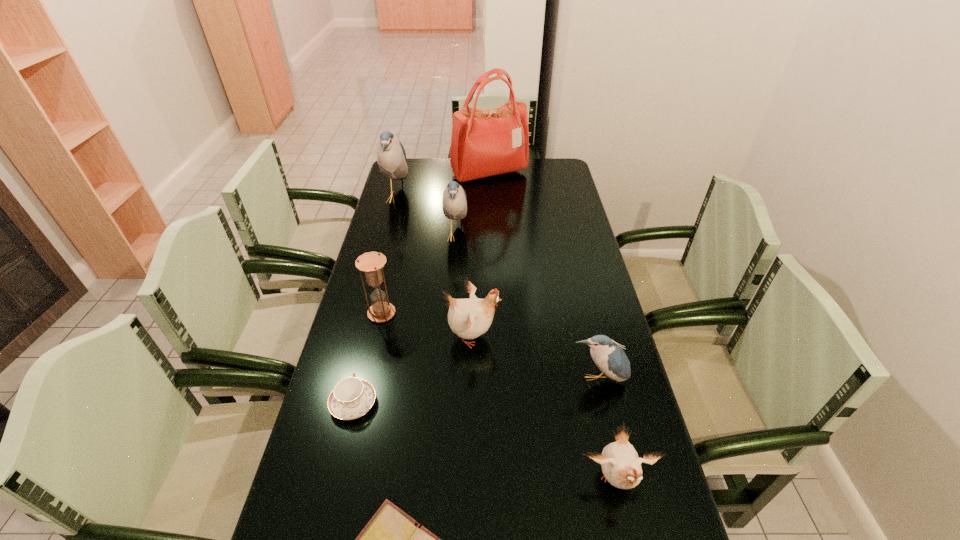
Find the location of a particular element. vacant region located at the tip of the fourth farthest bird's beak is located at coordinates [x=623, y=492].

Locate an element on the screen. The width and height of the screenshot is (960, 540). vacant space located on the side with the handle of the teacup is located at coordinates (363, 365).

Locate an element on the screen. free space located 0.310m on the side with the handle of the teacup is located at coordinates (378, 300).

Locate an element on the screen. The height and width of the screenshot is (540, 960). free space located 0.160m on the side with the handle of the teacup is located at coordinates (370, 336).

Image resolution: width=960 pixels, height=540 pixels. In order to click on handbag that is positioned at the far edge in this screenshot , I will do (x=485, y=142).

You are a GUI agent. You are given a task and a screenshot of the screen. Output one action in this format:
    pyautogui.click(x=<x>, y=<y>)
    Task: Click on the bird present at the far edge
    
    Given the screenshot: What is the action you would take?
    pyautogui.click(x=391, y=157)

The width and height of the screenshot is (960, 540). Identify the location of bird positioned at the left edge. (391, 157).

I want to click on hourglass situated at the left edge, so click(371, 263).

Find the location of a particular element. Image resolution: width=960 pixels, height=540 pixels. teacup that is at the left edge is located at coordinates (351, 398).

This screenshot has height=540, width=960. What are the coordinates of `object at the far left corner` in the screenshot? It's located at (391, 157).